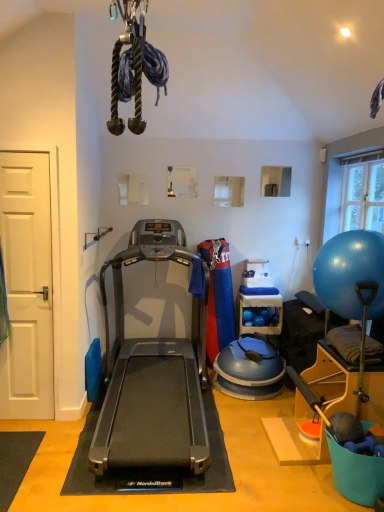
Question: Is silver metallic treadmill at center located within blue rubber ball at right?

Choices:
 (A) no
 (B) yes

Answer: (A)

Question: Does blue rubber ball at right have a smaller size compared to silver metallic treadmill at center?

Choices:
 (A) no
 (B) yes

Answer: (B)

Question: Can you confirm if blue rubber ball at right is thinner than silver metallic treadmill at center?

Choices:
 (A) yes
 (B) no

Answer: (A)

Question: From the image's perspective, does blue rubber ball at right appear lower than silver metallic treadmill at center?

Choices:
 (A) yes
 (B) no

Answer: (B)

Question: Would you consider blue rubber ball at right to be distant from silver metallic treadmill at center?

Choices:
 (A) no
 (B) yes

Answer: (B)

Question: From the image's perspective, would you say blue rubber ball at right is positioned over silver metallic treadmill at center?

Choices:
 (A) no
 (B) yes

Answer: (B)

Question: Is blue rubber ball at right smaller than transparent glass window at upper right?

Choices:
 (A) no
 (B) yes

Answer: (A)

Question: Is transparent glass window at upper right completely or partially inside blue rubber ball at right?

Choices:
 (A) no
 (B) yes

Answer: (A)

Question: Is blue rubber ball at right behind transparent glass window at upper right?

Choices:
 (A) yes
 (B) no

Answer: (B)

Question: Can you confirm if blue rubber ball at right is wider than transparent glass window at upper right?

Choices:
 (A) yes
 (B) no

Answer: (A)

Question: Considering the relative sizes of blue rubber ball at right and transparent glass window at upper right in the image provided, is blue rubber ball at right shorter than transparent glass window at upper right?

Choices:
 (A) no
 (B) yes

Answer: (B)

Question: From the image's perspective, would you say blue rubber ball at right is shown under transparent glass window at upper right?

Choices:
 (A) no
 (B) yes

Answer: (B)

Question: Would you say wooden shelf at center is outside white matte door at left?

Choices:
 (A) no
 (B) yes

Answer: (B)